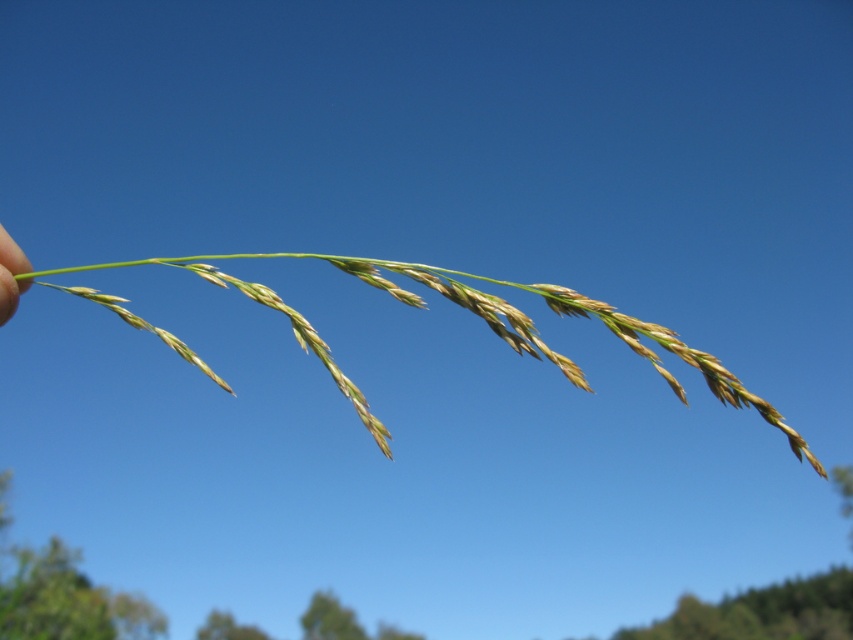
You are a gardener who needs to plant a new flower between the green grass at center and the skinny green stem at left. The flower requires a minimum of 12 inches of space to grow properly. Based on the image, can you plant the flower in the available space between them?

The distance between the green grass at center and the skinny green stem at left is 15.60 inches, which is more than the required 12 inches. Therefore, you can plant the flower there.

You are a gardener examining a plant. You notice the green grass at center and the skinny green stem at left. Which one is closer to you?

The green grass at center is closer to you than the skinny green stem at left.